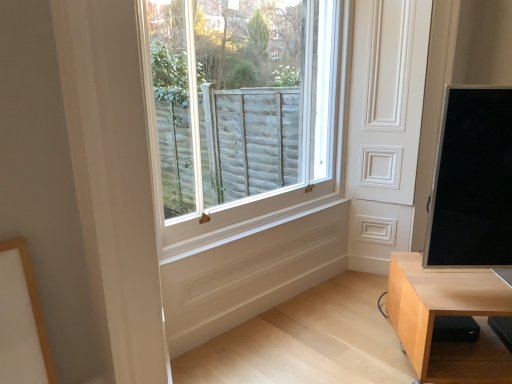
Question: Does light wood table at lower right come behind white wooden window at center?

Choices:
 (A) no
 (B) yes

Answer: (A)

Question: Is light wood table at lower right outside of white wooden window at center?

Choices:
 (A) yes
 (B) no

Answer: (A)

Question: Is light wood table at lower right shorter than white wooden window at center?

Choices:
 (A) no
 (B) yes

Answer: (B)

Question: From the image's perspective, is light wood table at lower right above white wooden window at center?

Choices:
 (A) yes
 (B) no

Answer: (B)

Question: Is light wood table at lower right facing towards white wooden window at center?

Choices:
 (A) no
 (B) yes

Answer: (A)

Question: Considering the relative sizes of light wood table at lower right and white wooden window at center in the image provided, is light wood table at lower right smaller than white wooden window at center?

Choices:
 (A) no
 (B) yes

Answer: (B)

Question: Is light wood table at lower right completely or partially outside of black glossy screen at right?

Choices:
 (A) no
 (B) yes

Answer: (B)

Question: Is light wood table at lower right aimed at black glossy screen at right?

Choices:
 (A) no
 (B) yes

Answer: (A)

Question: Can you confirm if light wood table at lower right is bigger than black glossy screen at right?

Choices:
 (A) yes
 (B) no

Answer: (A)

Question: Is light wood table at lower right looking in the opposite direction of black glossy screen at right?

Choices:
 (A) yes
 (B) no

Answer: (B)

Question: Is black glossy screen at right located within light wood table at lower right?

Choices:
 (A) no
 (B) yes

Answer: (A)

Question: Considering the relative positions of light wood table at lower right and black glossy screen at right in the image provided, is light wood table at lower right to the right of black glossy screen at right from the viewer's perspective?

Choices:
 (A) no
 (B) yes

Answer: (B)

Question: Considering the relative sizes of white wooden window at center and black glossy screen at right in the image provided, is white wooden window at center taller than black glossy screen at right?

Choices:
 (A) yes
 (B) no

Answer: (A)